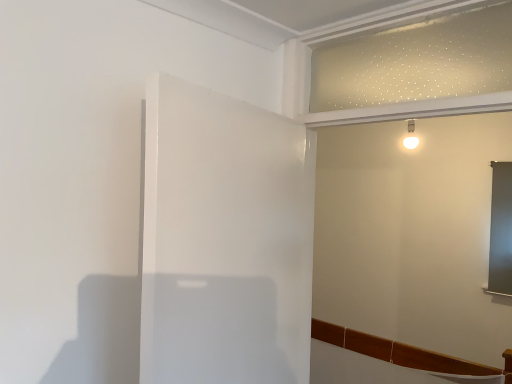
The image size is (512, 384). What do you see at coordinates (412, 233) in the screenshot?
I see `matte white wall at upper center` at bounding box center [412, 233].

Locate an element on the screen. matte white wall at upper center is located at coordinates (412, 233).

Describe the element at coordinates (225, 239) in the screenshot. I see `white glossy door at center` at that location.

Locate an element on the screen. This screenshot has width=512, height=384. white glossy door at center is located at coordinates (225, 239).

The width and height of the screenshot is (512, 384). What are the coordinates of `matte white wall at upper center` in the screenshot? It's located at (412, 233).

Between white glossy door at center and matte white wall at upper center, which one appears on the left side from the viewer's perspective?

white glossy door at center is more to the left.

Consider the image. Considering the positions of objects white glossy door at center and matte white wall at upper center in the image provided, who is in front, white glossy door at center or matte white wall at upper center?

white glossy door at center.

Is point (196, 379) positioned behind point (408, 341)?

No.

From the image's perspective, which one is positioned lower, white glossy door at center or matte white wall at upper center?

white glossy door at center is shown below in the image.

From a real-world perspective, is white glossy door at center positioned over matte white wall at upper center based on gravity?

No, from a real-world perspective, white glossy door at center is not on top of matte white wall at upper center.

Looking at this image, considering the relative sizes of white glossy door at center and matte white wall at upper center in the image provided, is white glossy door at center wider than matte white wall at upper center?

No, white glossy door at center is not wider than matte white wall at upper center.

Can you confirm if white glossy door at center is taller than matte white wall at upper center?

Incorrect, the height of white glossy door at center is not larger of that of matte white wall at upper center.

Considering the relative sizes of white glossy door at center and matte white wall at upper center in the image provided, is white glossy door at center smaller than matte white wall at upper center?

Indeed, white glossy door at center has a smaller size compared to matte white wall at upper center.

Do you think white glossy door at center is within matte white wall at upper center, or outside of it?

The correct answer is: outside.

Is white glossy door at center far from matte white wall at upper center?

Yes, white glossy door at center and matte white wall at upper center are quite far apart.

Does white glossy door at center turn towards matte white wall at upper center?

Yes, white glossy door at center faces towards matte white wall at upper center.

How many degrees apart are the facing directions of white glossy door at center and matte white wall at upper center?

102 degrees.

How much distance is there between white glossy door at center and matte white wall at upper center?

They are 2.09 meters apart.

At what (x,y) coordinates should I click in order to perform the action: click on backdrop behind the white glossy door at center. Please return your answer as a coordinate pair (x, y). This screenshot has height=384, width=512. Looking at the image, I should click on (412, 233).

Can you confirm if matte white wall at upper center is positioned to the right of white glossy door at center?

Correct, you'll find matte white wall at upper center to the right of white glossy door at center.

Which object is closer to the camera taking this photo, matte white wall at upper center or white glossy door at center?

Positioned in front is white glossy door at center.

Between point (421, 259) and point (247, 232), which one is positioned behind?

The point (421, 259) is behind.

Based on the photo, from the image's perspective, which is above, matte white wall at upper center or white glossy door at center?

matte white wall at upper center, from the image's perspective.

From a real-world perspective, which object stands above the other?

matte white wall at upper center is physically above.

Which of these two, matte white wall at upper center or white glossy door at center, is wider?

matte white wall at upper center is wider.

Considering the relative sizes of matte white wall at upper center and white glossy door at center in the image provided, is matte white wall at upper center shorter than white glossy door at center?

Incorrect, the height of matte white wall at upper center does not fall short of that of white glossy door at center.

Between matte white wall at upper center and white glossy door at center, which one has larger size?

With larger size is matte white wall at upper center.

Can white glossy door at center be found inside matte white wall at upper center?

Actually, white glossy door at center is outside matte white wall at upper center.

Would you consider matte white wall at upper center to be distant from white glossy door at center?

Indeed, matte white wall at upper center is not near white glossy door at center.

Is matte white wall at upper center aimed at white glossy door at center?

Yes, matte white wall at upper center is oriented towards white glossy door at center.

In the scene shown: Can you tell me how much matte white wall at upper center and white glossy door at center differ in facing direction?

102 degrees separate the facing orientations of matte white wall at upper center and white glossy door at center.

This screenshot has height=384, width=512. I want to click on backdrop on the right of white glossy door at center, so click(412, 233).

The width and height of the screenshot is (512, 384). I want to click on backdrop on the right of white glossy door at center, so click(x=412, y=233).

You are a GUI agent. You are given a task and a screenshot of the screen. Output one action in this format:
    pyautogui.click(x=<x>, y=<y>)
    Task: Click on the backdrop that appears above the white glossy door at center (from a real-world perspective)
    
    Given the screenshot: What is the action you would take?
    pyautogui.click(x=412, y=233)